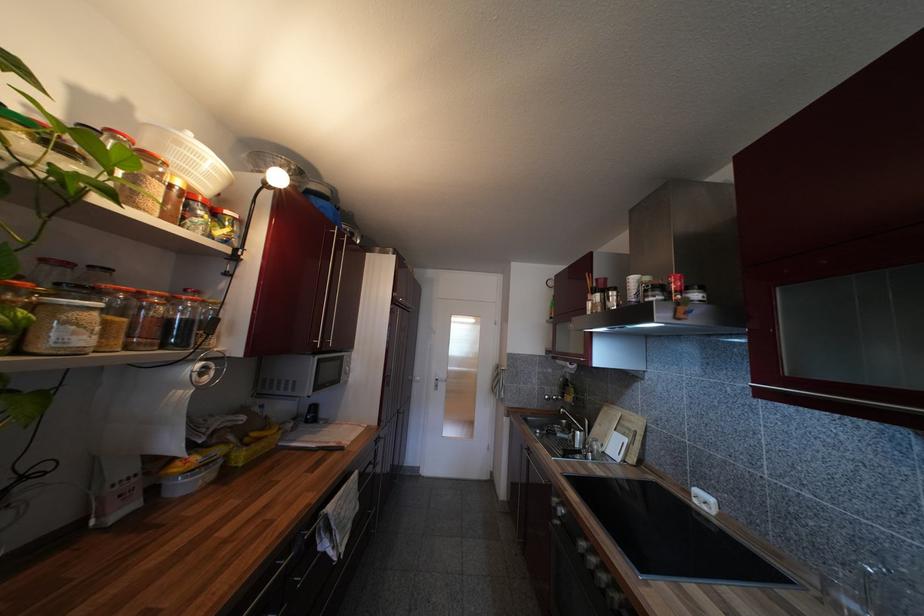
What do you see at coordinates (578, 411) in the screenshot?
I see `a silver door handle` at bounding box center [578, 411].